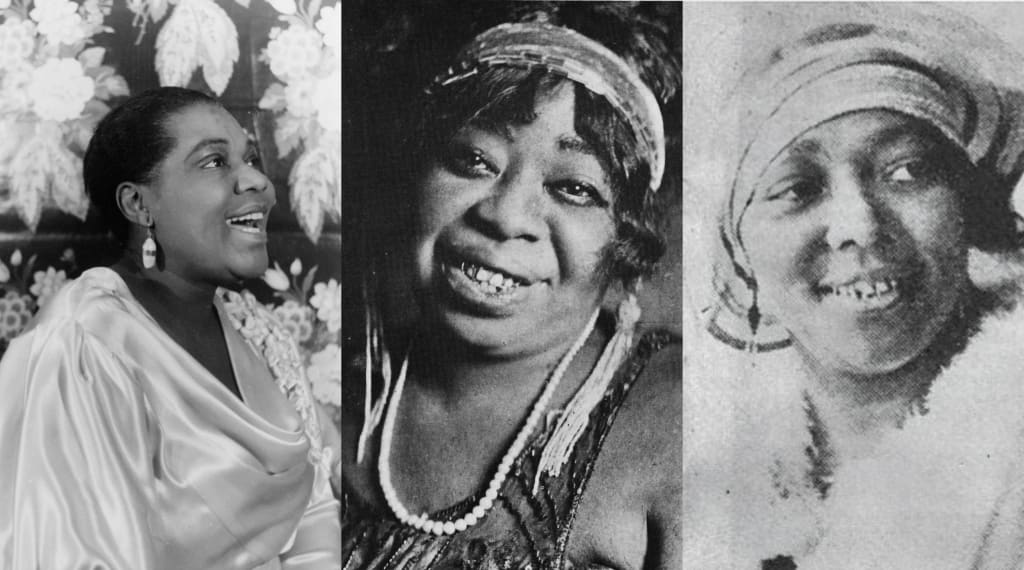
In order to click on photographs in this screenshot , I will do `click(231, 335)`, `click(494, 350)`, `click(916, 357)`.